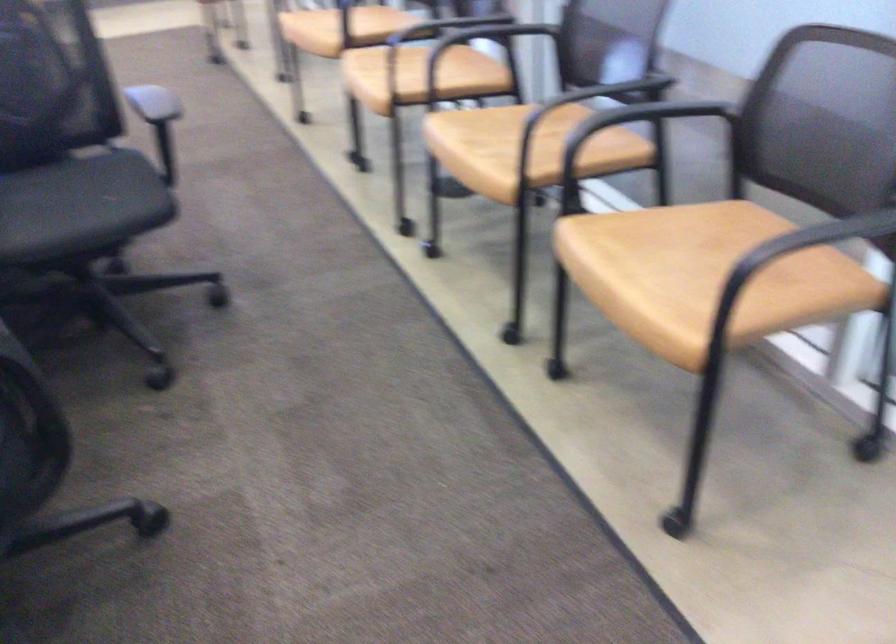
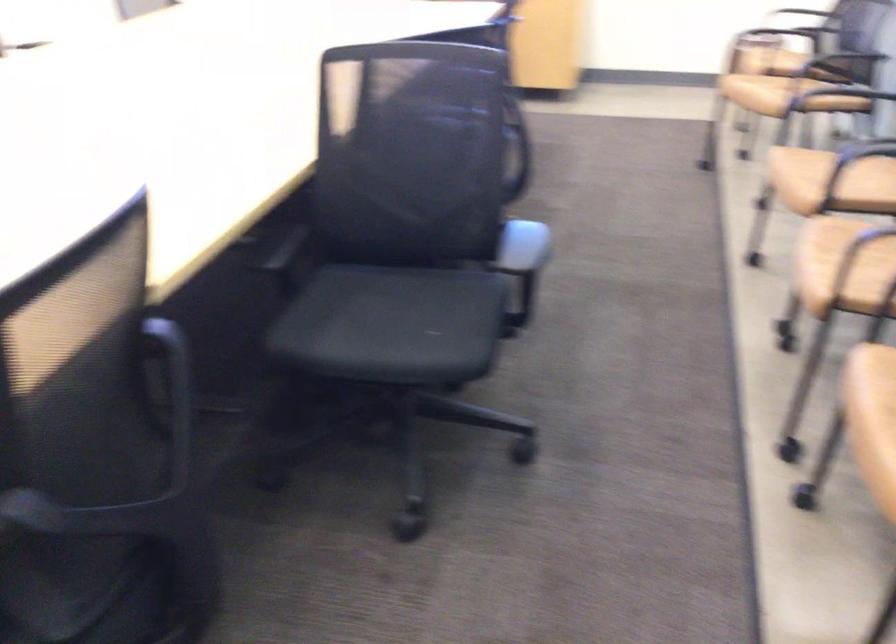
In the second image, find the point that corresponds to point 383,70 in the first image.

(842, 242)